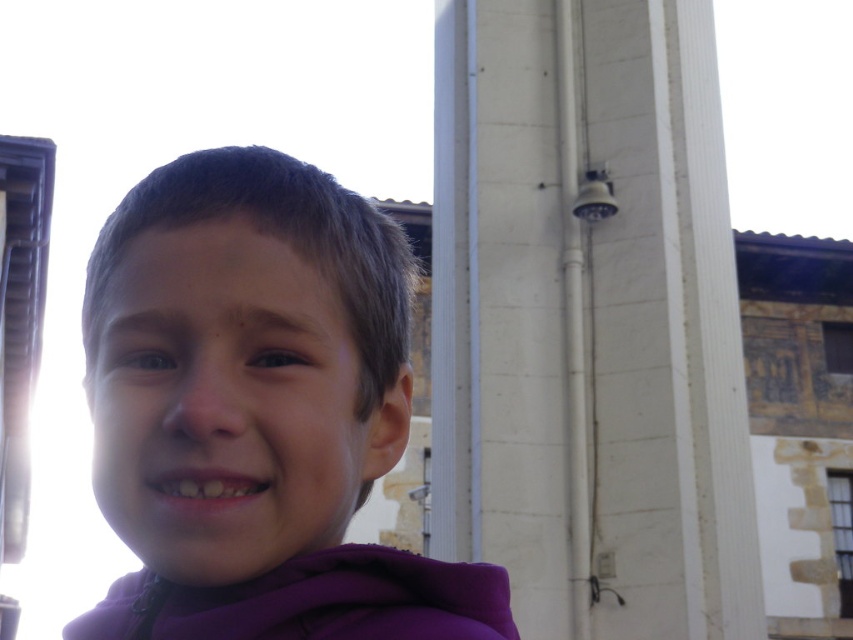
Is point (378, 324) closer to camera compared to point (838, 355)?

That is True.

Between purple fleece at center and transparent glass window at upper right, which one has more height?

purple fleece at center

The width and height of the screenshot is (853, 640). I want to click on purple fleece at center, so click(257, 412).

At what (x,y) coordinates should I click in order to perform the action: click on purple fleece at center. Please return your answer as a coordinate pair (x, y). Looking at the image, I should click on (257, 412).

Is purple fleece at center positioned at the back of clear glass window at lower right?

No, it is in front of clear glass window at lower right.

Between purple fleece at center and clear glass window at lower right, which one has more height?

Standing taller between the two is purple fleece at center.

The width and height of the screenshot is (853, 640). I want to click on purple fleece at center, so click(257, 412).

This screenshot has height=640, width=853. I want to click on purple fleece at center, so click(x=257, y=412).

Does clear glass window at lower right have a lesser width compared to transparent glass window at upper right?

Indeed, clear glass window at lower right has a lesser width compared to transparent glass window at upper right.

Between clear glass window at lower right and transparent glass window at upper right, which one is positioned higher?

transparent glass window at upper right is above.

Does point (843, 595) lie behind point (824, 349)?

No, it is in front of (824, 349).

Locate an element on the screen. clear glass window at lower right is located at coordinates (842, 532).